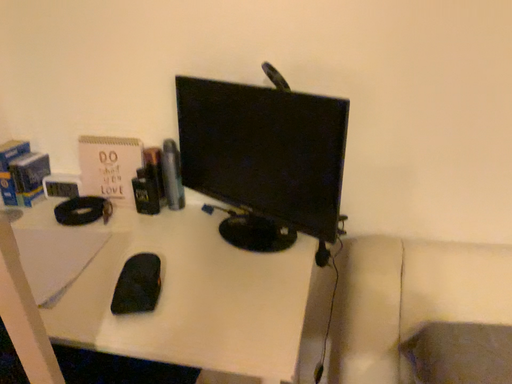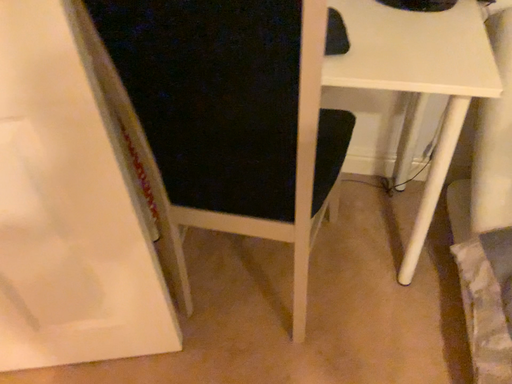
Question: How did the camera likely rotate when shooting the video?

Choices:
 (A) rotated downward
 (B) rotated upward

Answer: (A)